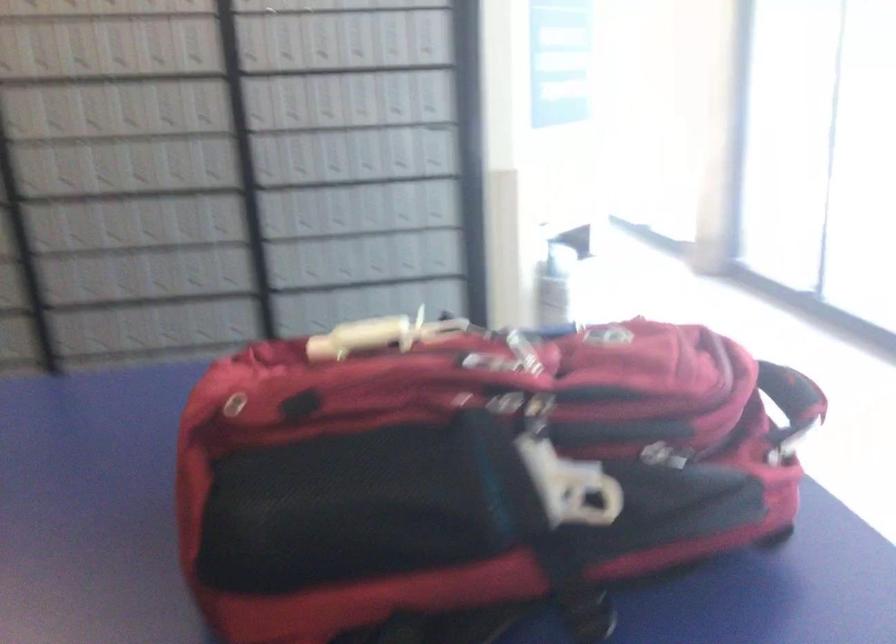
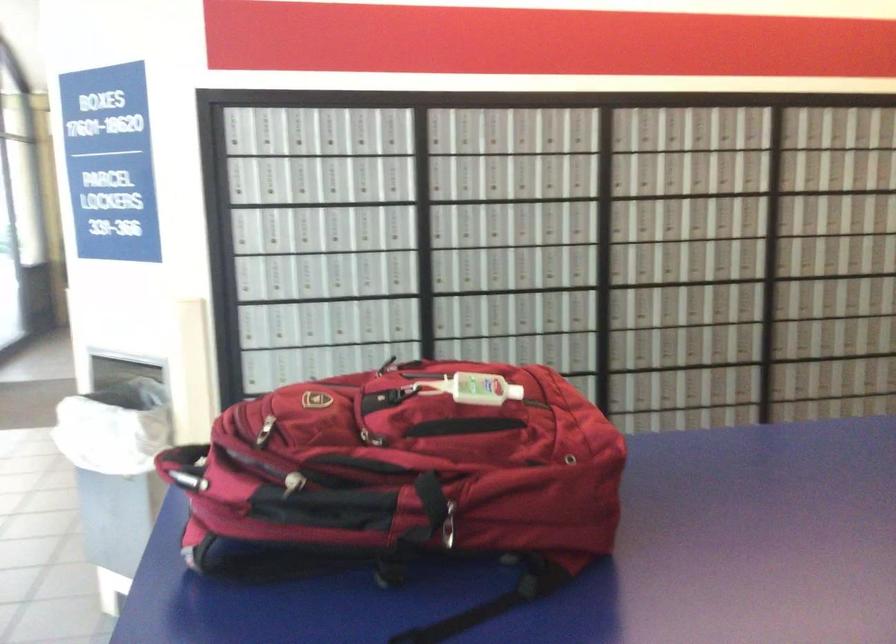
Locate, in the second image, the point that corresponds to (350,344) in the first image.

(471, 389)